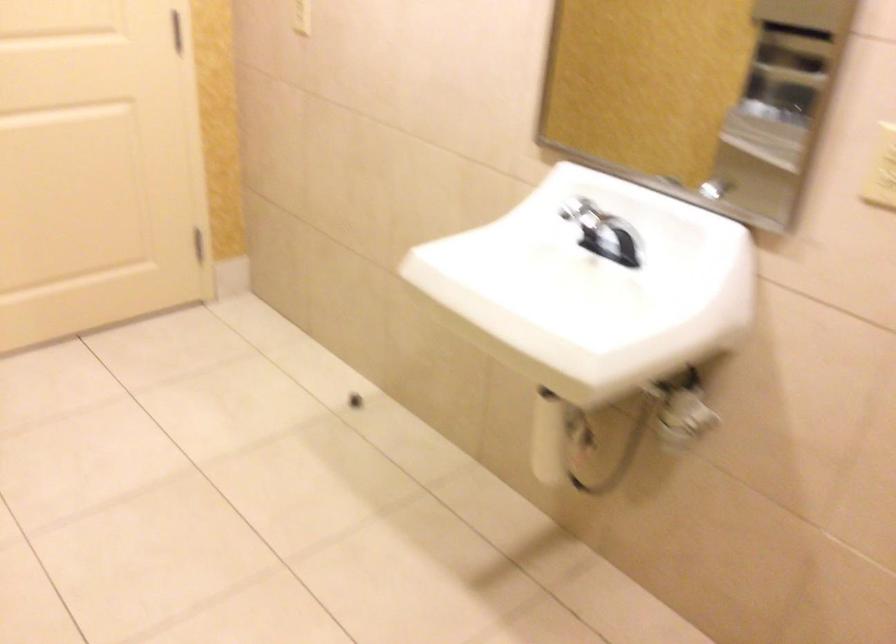
Question: How did the camera likely rotate?

Choices:
 (A) Left
 (B) Right
 (C) Up
 (D) Down

Answer: (A)